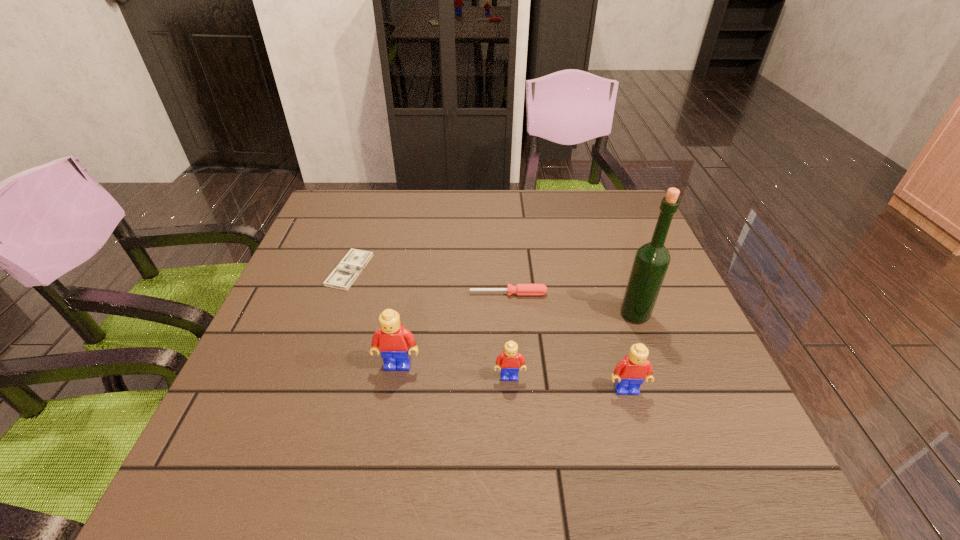
Where is `liquor present at the right edge`? The image size is (960, 540). liquor present at the right edge is located at coordinates (652, 259).

The width and height of the screenshot is (960, 540). I want to click on object that is at the near right corner, so click(x=630, y=372).

The image size is (960, 540). What are the coordinates of `vacant space at the far edge` in the screenshot? It's located at (404, 201).

This screenshot has height=540, width=960. In order to click on vacant space at the near edge in this screenshot , I will do `click(601, 396)`.

The height and width of the screenshot is (540, 960). In order to click on vacant space at the left edge in this screenshot , I will do `click(284, 310)`.

Where is `vacant space at the right edge of the desktop`? vacant space at the right edge of the desktop is located at coordinates (660, 289).

At what (x,y) coordinates should I click in order to perform the action: click on vacant area at the far left corner. Please return your answer as a coordinate pair (x, y). This screenshot has width=960, height=540. Looking at the image, I should click on (376, 193).

Where is `free space at the near left corner of the desktop`? The height and width of the screenshot is (540, 960). free space at the near left corner of the desktop is located at coordinates (240, 407).

What are the coordinates of `free space at the far right corner` in the screenshot? It's located at (612, 225).

Image resolution: width=960 pixels, height=540 pixels. Find the location of `unoccupied position between the screwdriver and the rightmost Lego`. unoccupied position between the screwdriver and the rightmost Lego is located at coordinates (567, 341).